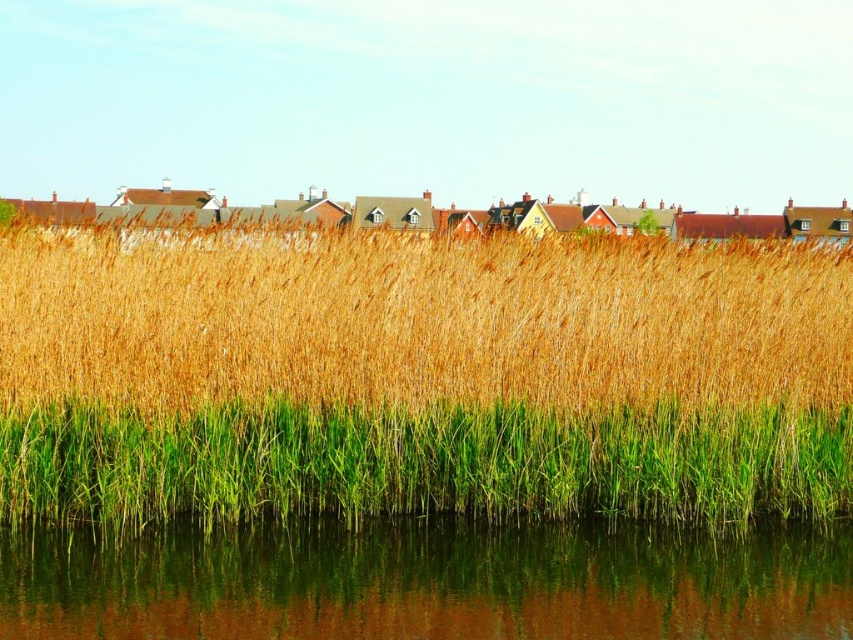
You are standing at the center of the image and see the point marked at coordinates (418, 320). What is the color of the object located at that point?

The point at coordinates (418, 320) corresponds to golden grass at center, so the color is golden.

You are standing in the landscape scene and want to move from the point at coordinates point [447,352] to the point at coordinates point [103,460]. Which direction should you move to get closer to the latter?

You should move towards the lower right direction because point [103,460] is closer to the camera than point [447,352], so moving in that direction would bring you closer to it.

You are a gardener who wants to plant a new flower bed between the golden grass at center and the green grass at lower center. The flower bed requires a minimum space of 3 meters. Can you fit it there?

The distance between the golden grass at center and the green grass at lower center is 4.05 meters, which is more than the required 3 meters. Therefore, the flower bed can be planted there.